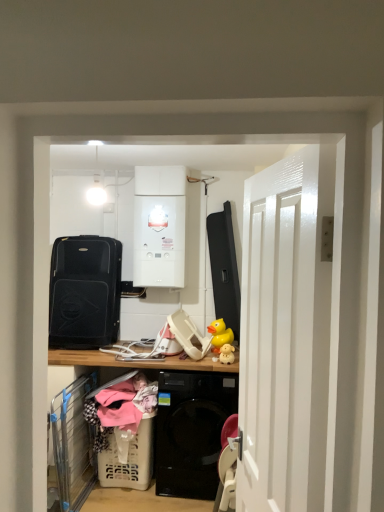
Question: From their relative heights in the image, would you say white glossy boiler at upper center, which appears as the second appliance when viewed from the left, is taller or shorter than yellow rubber duck at center?

Choices:
 (A) short
 (B) tall

Answer: (B)

Question: Is white glossy boiler at upper center, which appears as the second appliance when viewed from the left, inside the boundaries of yellow rubber duck at center, or outside?

Choices:
 (A) inside
 (B) outside

Answer: (B)

Question: Which object is positioned closest to the yellow rubber duck at center?

Choices:
 (A) white plastic laundry basket at lower left
 (B) white glossy door at right
 (C) white glossy boiler at upper center, which appears as the second appliance when viewed from the left
 (D) black matte suitcase at left, which appears as the first appliance when viewed from the left
 (E) plastic laundry basket at lower center

Answer: (A)

Question: Estimate the real-world distances between objects in this image. Which object is closer to the black matte suitcase at left, arranged as the 2th appliance when viewed from the right?

Choices:
 (A) white plastic laundry basket at lower left
 (B) plastic laundry basket at lower center
 (C) white glossy boiler at upper center, which appears as the second appliance when viewed from the left
 (D) yellow rubber duck at center
 (E) white glossy door at right

Answer: (C)